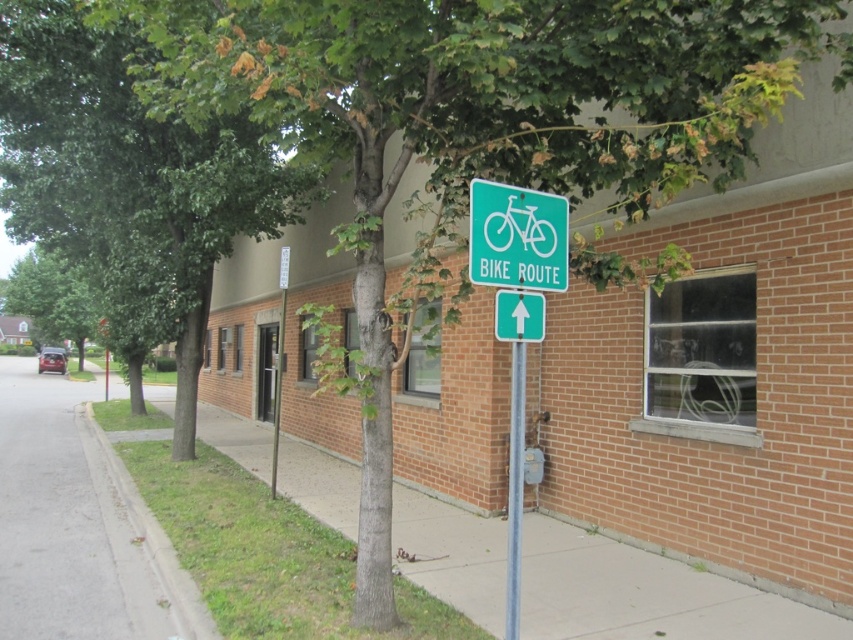
You are standing at the intersection and want to find the green leafy tree at center. According to the coordinates provided, where should you look relative to the center of the image?

The green leafy tree at center is located at coordinates point (128,182), which means it is positioned slightly to the left and above the center point of the image.

You are a delivery person trying to avoid stepping on the white plastic sign at upper center. Since you need to walk on the gray asphalt at lower left, will you be able to step on it without hitting the sign?

The gray asphalt at lower left is taller than the white plastic sign at upper center, so stepping on the gray asphalt at lower left won generated by you. 1. The question must include both objects from the Objects list exactly as given. 2. The answer must use the Objects Description to confirm the spatial relationship. 3. The question should be phrased from the observer or a person in the scene perspective. 4. The answer must not introduce new information beyond the provided data. 5. The answer must be a 10

You are standing at the point with coordinates point [508,490] and want to walk to the point with coordinates point [480,563]. Is there any obstruction between you and your destination?

Point [480,563] is behind point [508,490], so there is an obstruction between you and your destination.